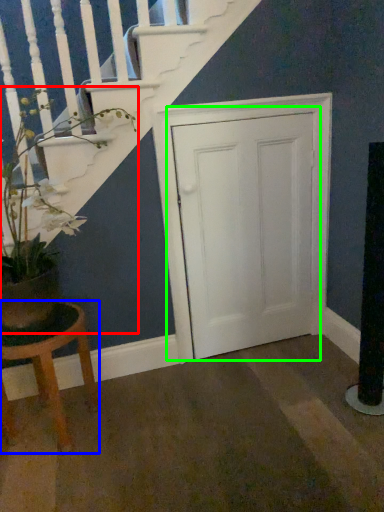
Question: Considering the real-world distances, which object is closest to houseplant (highlighted by a red box)? stool (highlighted by a blue box) or door (highlighted by a green box).

Choices:
 (A) stool
 (B) door

Answer: (A)